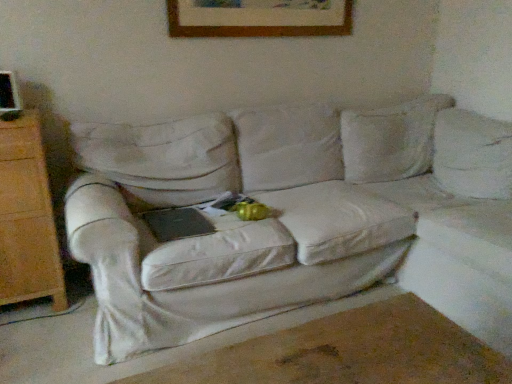
Question: Can you confirm if white fabric couch at center is bigger than wooden picture frame at upper center?

Choices:
 (A) no
 (B) yes

Answer: (B)

Question: From a real-world perspective, is white fabric couch at center under wooden picture frame at upper center?

Choices:
 (A) no
 (B) yes

Answer: (B)

Question: Can you confirm if white fabric couch at center is positioned to the left of wooden picture frame at upper center?

Choices:
 (A) no
 (B) yes

Answer: (A)

Question: From the image's perspective, does white fabric couch at center appear lower than wooden picture frame at upper center?

Choices:
 (A) yes
 (B) no

Answer: (A)

Question: Is white fabric couch at center taller than wooden picture frame at upper center?

Choices:
 (A) no
 (B) yes

Answer: (B)

Question: Is white fabric couch at center surrounding wooden picture frame at upper center?

Choices:
 (A) no
 (B) yes

Answer: (A)

Question: From a real-world perspective, does wooden picture frame at upper center stand above white fabric couch at center?

Choices:
 (A) no
 (B) yes

Answer: (B)

Question: Is wooden picture frame at upper center at the right side of white fabric couch at center?

Choices:
 (A) no
 (B) yes

Answer: (A)

Question: Is wooden picture frame at upper center surrounding white fabric couch at center?

Choices:
 (A) yes
 (B) no

Answer: (B)

Question: Is wooden picture frame at upper center positioned behind white fabric couch at center?

Choices:
 (A) yes
 (B) no

Answer: (A)

Question: Considering the relative sizes of wooden picture frame at upper center and white fabric couch at center in the image provided, is wooden picture frame at upper center smaller than white fabric couch at center?

Choices:
 (A) no
 (B) yes

Answer: (B)

Question: Considering the relative sizes of wooden picture frame at upper center and white fabric couch at center in the image provided, is wooden picture frame at upper center thinner than white fabric couch at center?

Choices:
 (A) no
 (B) yes

Answer: (B)

Question: Looking at the image, does white fabric couch at center seem bigger or smaller compared to wooden picture frame at upper center?

Choices:
 (A) big
 (B) small

Answer: (A)